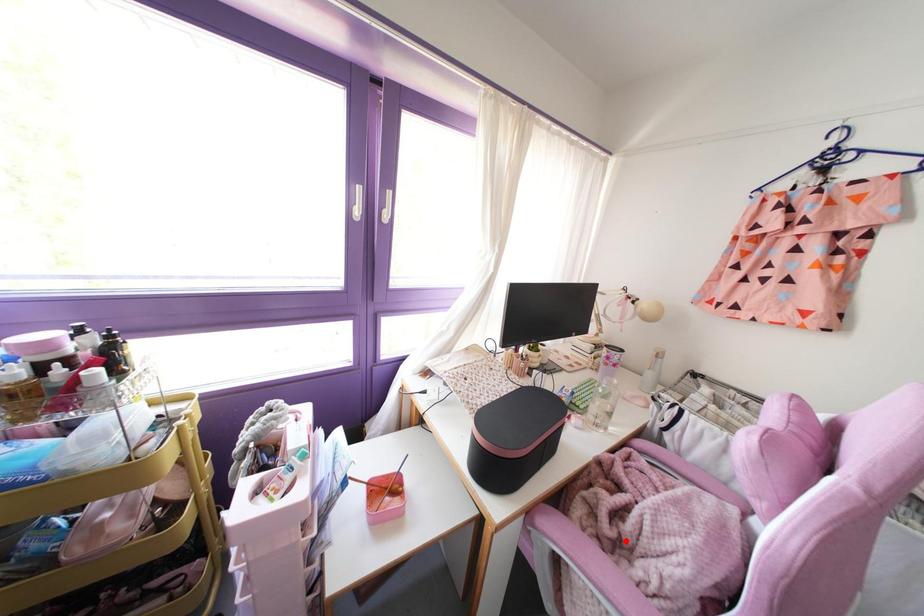
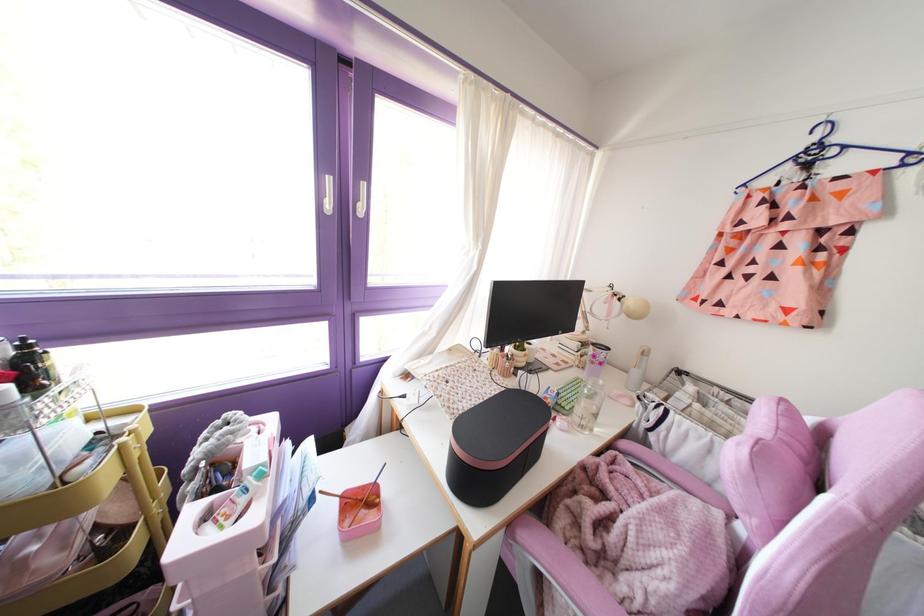
Locate, in the second image, the point that corresponds to the highlighted location in the first image.

(610, 553)